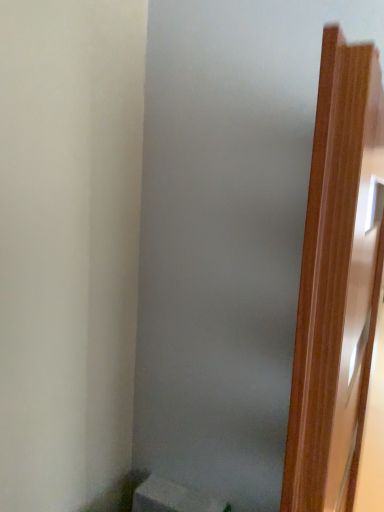
Where is `wooden door at right`? This screenshot has width=384, height=512. wooden door at right is located at coordinates (337, 281).

The height and width of the screenshot is (512, 384). Describe the element at coordinates (337, 281) in the screenshot. I see `wooden door at right` at that location.

Locate an element on the screen. The width and height of the screenshot is (384, 512). wooden door at right is located at coordinates (337, 281).